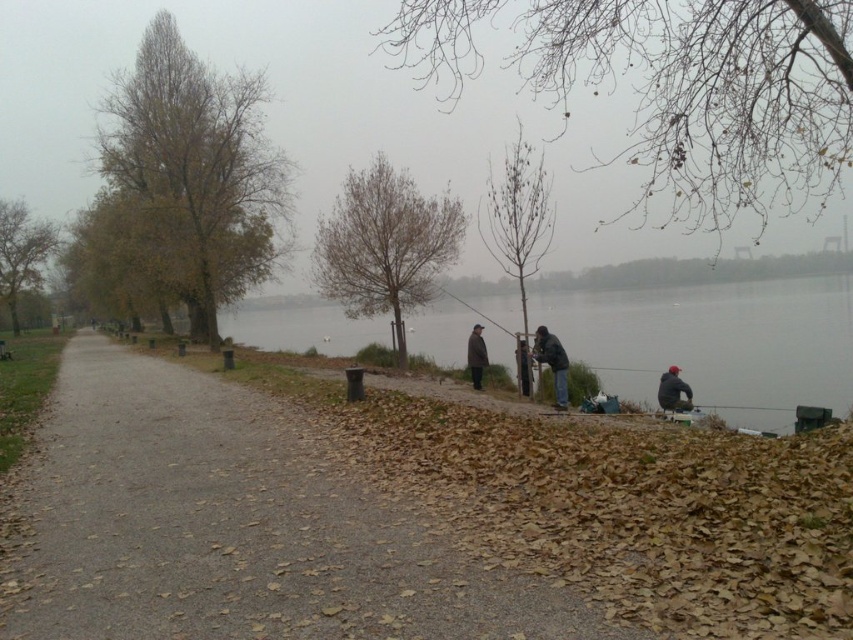
You are standing at point (483, 362) and want to walk towards the lake edge where the three people are fishing. There is an obstacle at point (390, 496). Will you pass in front of or behind the obstacle?

Since point (390, 496) is in front of point (483, 362), you will pass behind the obstacle at point (390, 496) when moving towards the lake edge.

From the picture: You are standing at the point marked as point (717, 342) in the image. Looking around, you see a gray concrete lake at lower right. Which direction should you walk to reach the paved pathway that runs parallel to the lake?

Since point (717, 342) is on the gray concrete lake at lower right, you should walk north to reach the paved pathway that runs parallel to the lake.

You are standing at the center of the image and want to walk to the gray concrete lake at lower right. Which direction should you move in to reach it?

To reach the gray concrete lake at lower right, you should move towards the lower right direction since it is located at point (717, 342).